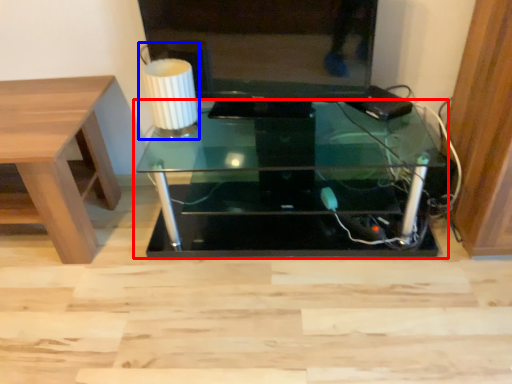
Question: Which of the following is the farthest to the observer, table (highlighted by a red box) or table lamp (highlighted by a blue box)?

Choices:
 (A) table
 (B) table lamp

Answer: (B)